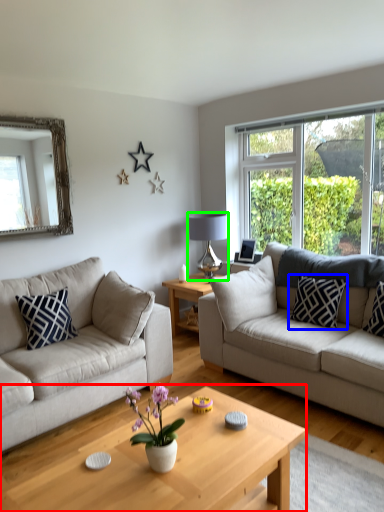
Question: Based on their relative distances, which object is farther from coffee table (highlighted by a red box)? Choose from pillow (highlighted by a blue box) and lamp (highlighted by a green box).

Choices:
 (A) pillow
 (B) lamp

Answer: (B)